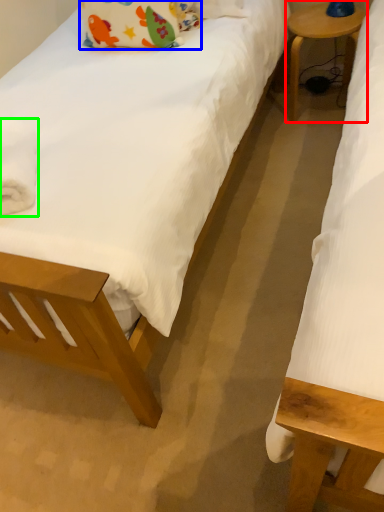
Question: Which is farther away from table (highlighted by a red box)? pillow (highlighted by a blue box) or material (highlighted by a green box)?

Choices:
 (A) pillow
 (B) material

Answer: (B)